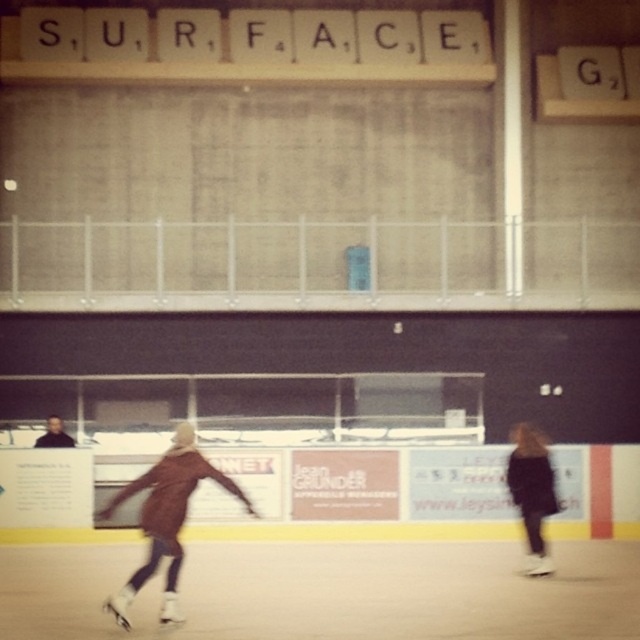
You are a photographer standing at the center of the ice rink. You want to take a photo of both the brown matte jacket at lower left and the dark brown leather jacket at lower right. Which jacket will appear larger in the photo?

The brown matte jacket at lower left will appear larger in the photo because it is much taller than the dark brown leather jacket at lower right.

You are standing at the center of the ice rink and want to locate the brown matte jacket at lower left. Based on its 2D coordinates, in which direction should you look to find it?

The brown matte jacket at lower left is located at coordinates 0.808 on the x axis and 0.259 on the y axis. Since the x value is closer to 1, it means it is positioned to the right side of the image. The y value being closer to 0 indicates it is near the bottom. Therefore, you should look towards the lower right direction to find the brown matte jacket at lower left.